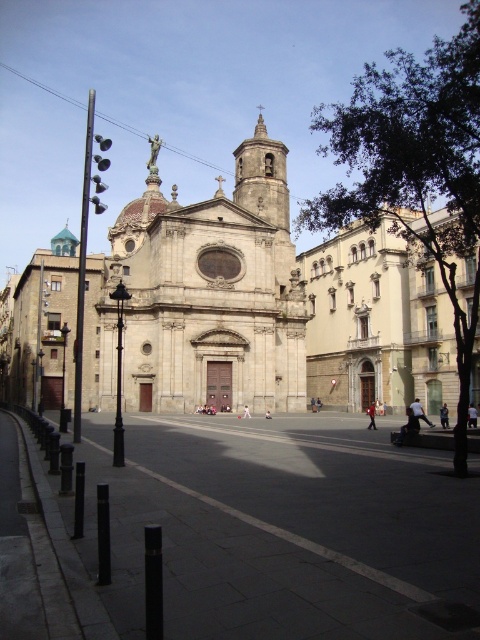
Question: Which of the following is the farthest from the observer?

Choices:
 (A) smooth stone bell tower at center
 (B) dark concrete plaza at center

Answer: (A)

Question: Which point is closer to the camera taking this photo?

Choices:
 (A) (441, 593)
 (B) (261, 195)

Answer: (A)

Question: Is gray stone church at center thinner than smooth stone bell tower at center?

Choices:
 (A) no
 (B) yes

Answer: (A)

Question: Does gray stone church at center appear under smooth stone bell tower at center?

Choices:
 (A) no
 (B) yes

Answer: (B)

Question: Among these objects, which one is nearest to the camera?

Choices:
 (A) gray stone church at center
 (B) smooth stone bell tower at center
 (C) dark concrete plaza at center

Answer: (C)

Question: Is dark concrete plaza at center smaller than gray stone church at center?

Choices:
 (A) no
 (B) yes

Answer: (B)